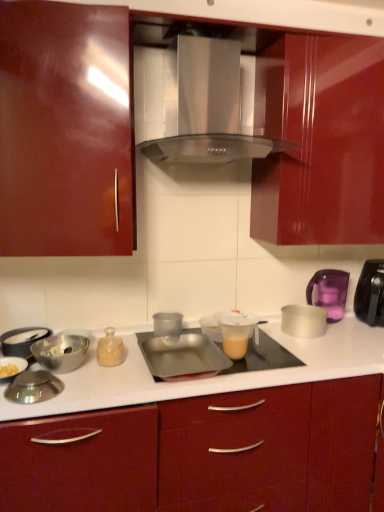
Where is `spots to the right of shiny silver lid at lower left, positioned as the 6th appliance in right-to-left order`? Image resolution: width=384 pixels, height=512 pixels. spots to the right of shiny silver lid at lower left, positioned as the 6th appliance in right-to-left order is located at coordinates (94, 386).